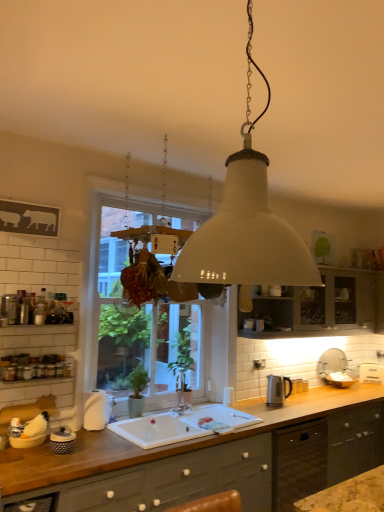
Question: Is white ceramic sink at center bigger than white matte lampshade at center?

Choices:
 (A) yes
 (B) no

Answer: (B)

Question: Can we say white ceramic sink at center lies outside white matte lampshade at center?

Choices:
 (A) no
 (B) yes

Answer: (B)

Question: Is white ceramic sink at center thinner than white matte lampshade at center?

Choices:
 (A) yes
 (B) no

Answer: (B)

Question: Does white ceramic sink at center have a smaller size compared to white matte lampshade at center?

Choices:
 (A) yes
 (B) no

Answer: (A)

Question: From a real-world perspective, does white ceramic sink at center stand above white matte lampshade at center?

Choices:
 (A) no
 (B) yes

Answer: (A)

Question: In terms of height, does white glass window at center look taller or shorter compared to white ceramic sink at center?

Choices:
 (A) tall
 (B) short

Answer: (A)

Question: Considering the positions of point (87, 335) and point (180, 437), is point (87, 335) closer or farther from the camera than point (180, 437)?

Choices:
 (A) farther
 (B) closer

Answer: (A)

Question: Looking at their shapes, would you say white glass window at center is wider or thinner than white ceramic sink at center?

Choices:
 (A) wide
 (B) thin

Answer: (B)

Question: Considering the positions of white glass window at center and white ceramic sink at center in the image, is white glass window at center bigger or smaller than white ceramic sink at center?

Choices:
 (A) small
 (B) big

Answer: (B)

Question: From their relative heights in the image, would you say matte gray cabinets at lower center, the second cabinetry from the back, is taller or shorter than matte gray cabinet at center, the 2th cabinetry when ordered from bottom to top?

Choices:
 (A) short
 (B) tall

Answer: (B)

Question: Is matte gray cabinets at lower center, the second cabinetry from the back, bigger or smaller than matte gray cabinet at center, positioned as the 2th cabinetry in left-to-right order?

Choices:
 (A) big
 (B) small

Answer: (A)

Question: From the image's perspective, is matte gray cabinets at lower center, placed as the 2th cabinetry when sorted from top to bottom, above or below matte gray cabinet at center, positioned as the 2th cabinetry in left-to-right order?

Choices:
 (A) above
 (B) below

Answer: (B)

Question: Is point (254, 438) closer or farther from the camera than point (264, 308)?

Choices:
 (A) farther
 (B) closer

Answer: (B)

Question: From the image's perspective, is white ceramic sink at center above or below white glass window at center?

Choices:
 (A) below
 (B) above

Answer: (A)

Question: From a real-world perspective, is white ceramic sink at center physically located above or below white glass window at center?

Choices:
 (A) above
 (B) below

Answer: (B)